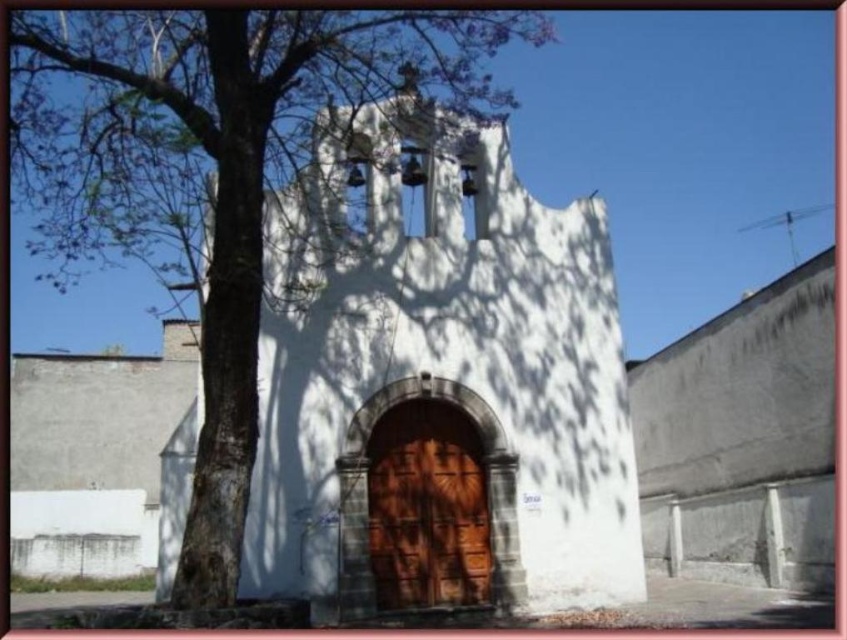
You are standing in front of the church and want to take a photo that includes both the green leafy tree at left and the brown wooden door at center. Which object should you position closer to the edge of the frame to ensure both are fully visible?

The green leafy tree at left is taller than the brown wooden door at center, so you should position the green leafy tree at left closer to the edge of the frame to ensure both are fully visible.

You are standing in front of the church and want to take a photo of the brown wooden door at center. However, there is a green leafy tree at left blocking your view. Can you move to the right side to get a clear shot of the door without the tree obstructing it?

The green leafy tree at left is closer to the viewer than the brown wooden door at center, so moving to the right side should allow you to position yourself behind the tree and get a clear view of the brown wooden door at center without obstruction.